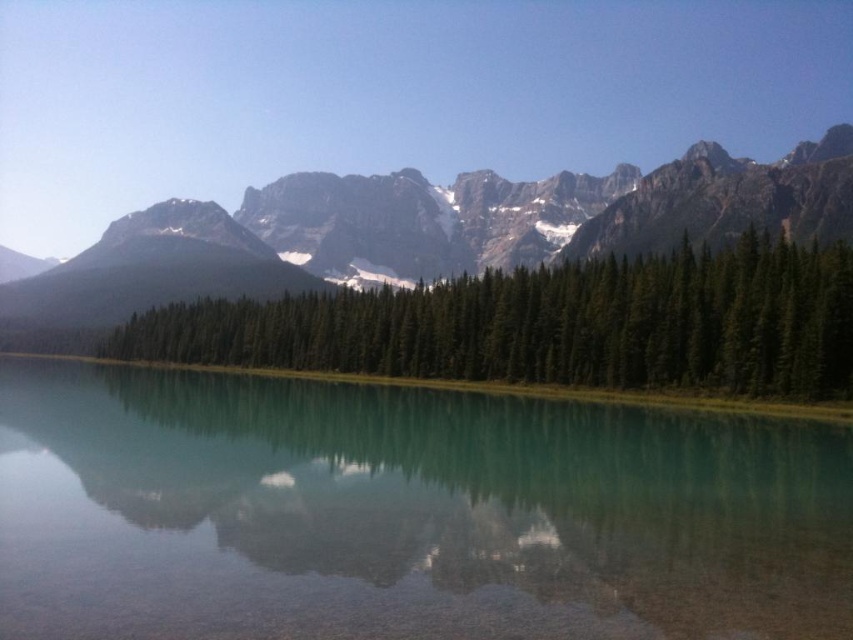
Is clear glass water at center wider than green matte trees at center?

In fact, clear glass water at center might be narrower than green matte trees at center.

Is clear glass water at center thinner than green matte trees at center?

Yes.

What do you see at coordinates (405, 513) in the screenshot? This screenshot has width=853, height=640. I see `clear glass water at center` at bounding box center [405, 513].

Identify the location of clear glass water at center. The height and width of the screenshot is (640, 853). (405, 513).

This screenshot has height=640, width=853. Describe the element at coordinates (405, 513) in the screenshot. I see `clear glass water at center` at that location.

Who is taller, clear glass water at center or rocky mountain range at upper center?

With more height is rocky mountain range at upper center.

Between point (283, 406) and point (689, 237), which one is positioned in front?

Point (283, 406) is more forward.

In order to click on clear glass water at center in this screenshot , I will do point(405,513).

Does point (498, 278) lie behind point (836, 132)?

No, it is in front of (836, 132).

Does green matte trees at center have a smaller size compared to rocky mountain range at upper center?

Yes.

Does point (492, 332) come behind point (83, 280)?

No, it is in front of (83, 280).

I want to click on green matte trees at center, so click(553, 324).